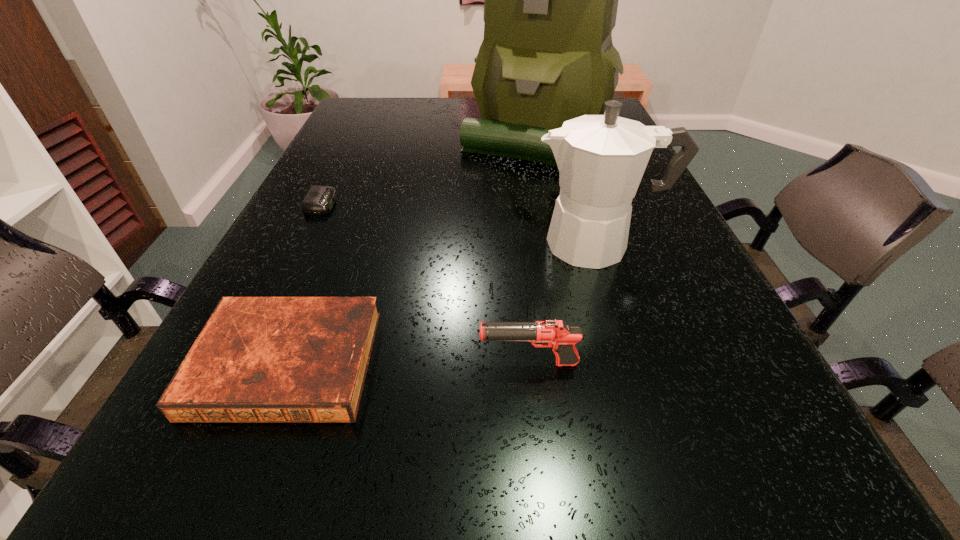
You are a GUI agent. You are given a task and a screenshot of the screen. Output one action in this format:
    pyautogui.click(x=<x>, y=<y>)
    Task: Click on the free region that satisfies the following two spatial constraints: 1. on the front of the backpack with visible pockets; 2. on the display of the shortest object
    
    Given the screenshot: What is the action you would take?
    pyautogui.click(x=547, y=204)

Identify the location of vacant position in the image that satisfies the following two spatial constraints: 1. on the front of the farthest object with visible pockets; 2. at the aiming end of the third tallest object. The width and height of the screenshot is (960, 540). (580, 363).

At what (x,y) coordinates should I click in order to perform the action: click on free region that satisfies the following two spatial constraints: 1. at the spout of the third nearest object; 2. on the spine side of the fourth tallest object. Please return your answer as a coordinate pair (x, y). Looking at the image, I should click on (637, 363).

You are a GUI agent. You are given a task and a screenshot of the screen. Output one action in this format:
    pyautogui.click(x=<x>, y=<y>)
    Task: Click on the free space that satisfies the following two spatial constraints: 1. at the spout of the coffeepot; 2. on the spine side of the Bible
    Image resolution: width=960 pixels, height=540 pixels.
    Given the screenshot: What is the action you would take?
    pyautogui.click(x=637, y=363)

Find the location of a particular element. The width and height of the screenshot is (960, 540). free location that satisfies the following two spatial constraints: 1. at the spout of the coffeepot; 2. on the spine side of the fourth tallest object is located at coordinates (637, 363).